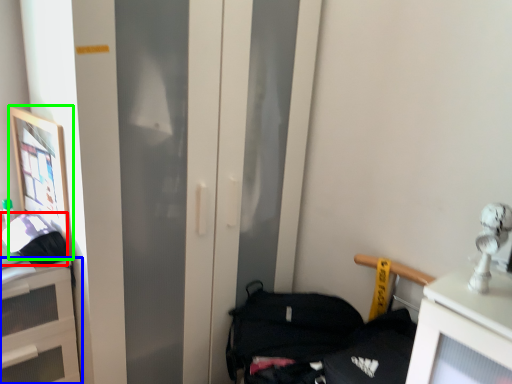
Question: Which is nearer to the handbag (highlighted by a red box)? cabinetry (highlighted by a blue box) or picture frame (highlighted by a green box).

Choices:
 (A) cabinetry
 (B) picture frame

Answer: (B)